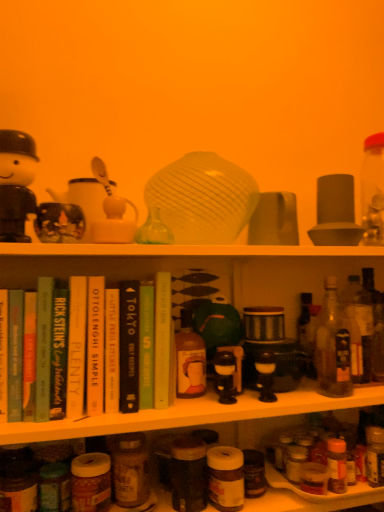
Question: Considering their positions, is green matte teapot at center, acting as the first toy starting from the bottom, located in front of or behind translucent glass bottle at right, which is counted as the third bottle, starting from the right?

Choices:
 (A) behind
 (B) front

Answer: (A)

Question: Is green matte teapot at center, acting as the first toy starting from the bottom, wider or thinner than translucent glass bottle at right, which is counted as the third bottle, starting from the right?

Choices:
 (A) thin
 (B) wide

Answer: (B)

Question: Based on their relative distances, which object is nearer to the green matte teapot at center, which is the 1th toy from right to left?

Choices:
 (A) hardcover book at center, which is the 1th book in right-to-left order
 (B) hardcover book at center, acting as the 4th book starting from the right
 (C) translucent glass bottle at right, marked as the first bottle in a right-to-left arrangement
 (D) translucent glass bottle at center, which ranks as the fourth bottle in right-to-left order
 (E) translucent glass bottle at lower right, the second bottle from the right

Answer: (D)

Question: Based on their relative distances, which object is farther from the translucent glass bottle at right, marked as the first bottle in a right-to-left arrangement?

Choices:
 (A) translucent glass bottle at center, which is counted as the 2th bottle, starting from the left
 (B) matte black figurine at upper left, marked as the 3th toy in a back-to-front arrangement
 (C) hardcover book at center, acting as the 4th book starting from the right
 (D) hardcover book at center, which is the 1th book in right-to-left order
 (E) translucent glass bottle at right, the third bottle in the left-to-right sequence

Answer: (B)